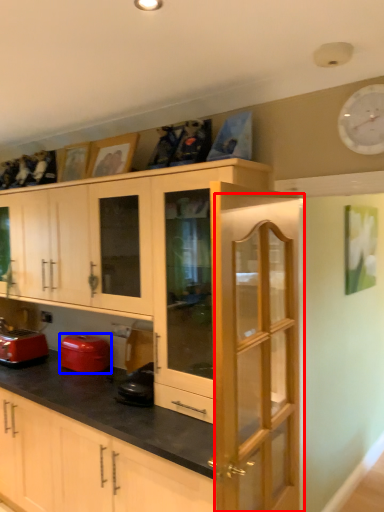
Question: Which object appears farthest to the camera in this image, screen door (highlighted by a red box) or appliance (highlighted by a blue box)?

Choices:
 (A) screen door
 (B) appliance

Answer: (B)